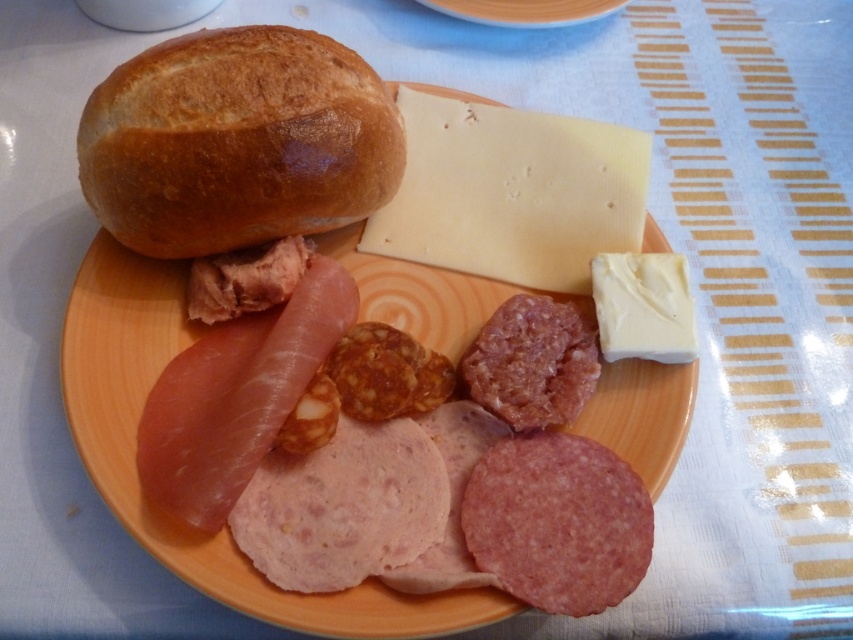
Is the position of golden brown crusty bun at upper left more distant than that of pink textured salami at center?

Yes, golden brown crusty bun at upper left is further from the viewer.

Between golden brown crusty bun at upper left and pink textured salami at center, which one appears on the right side from the viewer's perspective?

From the viewer's perspective, pink textured salami at center appears more on the right side.

Does point (256, 180) lie in front of point (550, 444)?

That is True.

Where is `golden brown crusty bun at upper left`? The image size is (853, 640). golden brown crusty bun at upper left is located at coordinates (236, 141).

Which is behind, point (660, 337) or point (450, 0)?

The point (450, 0) is more distant.

Is white creamy cheese at upper right taller than orange matte plate at center?

Indeed, white creamy cheese at upper right has a greater height compared to orange matte plate at center.

Does point (686, 308) come farther from viewer compared to point (448, 10)?

No, it is in front of (448, 10).

Where is `white creamy cheese at upper right`? white creamy cheese at upper right is located at coordinates (643, 307).

Does matte brown bread at upper left appear under yellowish semi-hard cheese at upper center?

Correct, matte brown bread at upper left is located below yellowish semi-hard cheese at upper center.

Is matte brown bread at upper left to the left of yellowish semi-hard cheese at upper center from the viewer's perspective?

Correct, you'll find matte brown bread at upper left to the left of yellowish semi-hard cheese at upper center.

Between point (329, 632) and point (360, 244), which one is positioned behind?

Positioned behind is point (360, 244).

Identify the location of matte brown bread at upper left. (138, 477).